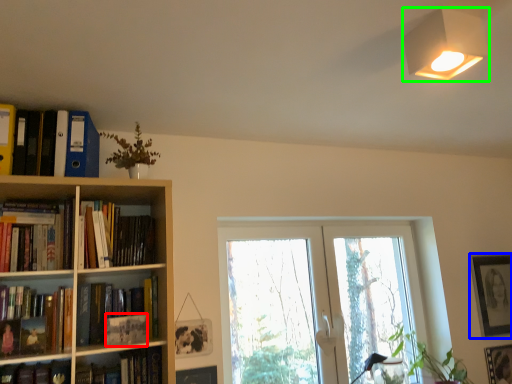
Question: Based on their relative distances, which object is nearer to paperback book (highlighted by a red box)? Choose from picture frame (highlighted by a blue box) and lamp (highlighted by a green box).

Choices:
 (A) picture frame
 (B) lamp

Answer: (B)